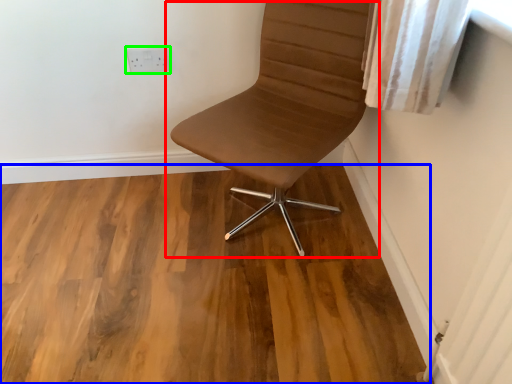
Question: Considering the real-world distances, which object is closest to chair (highlighted by a red box)? hardwood (highlighted by a blue box) or electric outlet (highlighted by a green box).

Choices:
 (A) hardwood
 (B) electric outlet

Answer: (A)